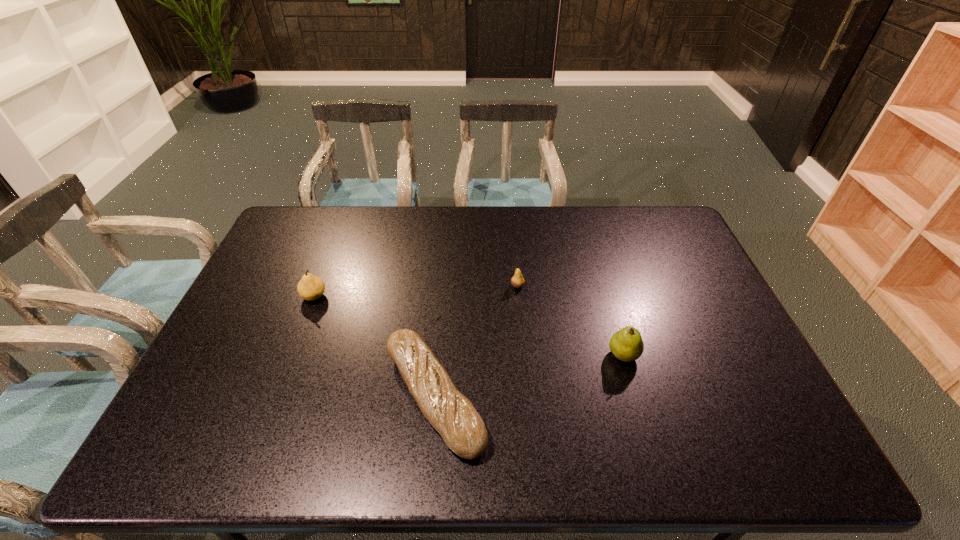
Image resolution: width=960 pixels, height=540 pixels. Find the location of `the rightmost object`. the rightmost object is located at coordinates (627, 345).

Where is `the nearest pear`? the nearest pear is located at coordinates (627, 345).

Identify the location of the leftmost object. (310, 287).

The width and height of the screenshot is (960, 540). Identify the location of the third object from left to right. (517, 281).

At what (x,y) coordinates should I click in order to perform the action: click on the shortest pear. Please return your answer as a coordinate pair (x, y). The image size is (960, 540). Looking at the image, I should click on (517, 281).

The height and width of the screenshot is (540, 960). I want to click on the second object from left to right, so click(x=453, y=415).

Locate an element on the screen. free region located 0.150m on the right of the nearest pear is located at coordinates (694, 355).

The image size is (960, 540). I want to click on vacant region located on the front of the leftmost pear, so click(x=272, y=406).

Identify the location of vacant space located 0.380m on the right of the second pear from right to left. The width and height of the screenshot is (960, 540). point(644,286).

At what (x,y) coordinates should I click in order to perform the action: click on vacant area located on the left of the baguet. Please return your answer as a coordinate pair (x, y). Image resolution: width=960 pixels, height=540 pixels. Looking at the image, I should click on (298, 396).